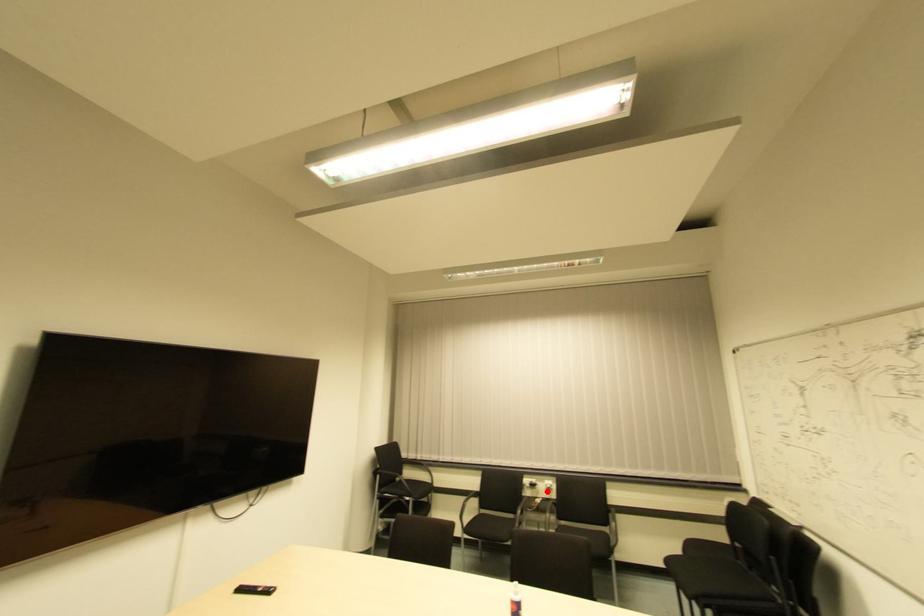
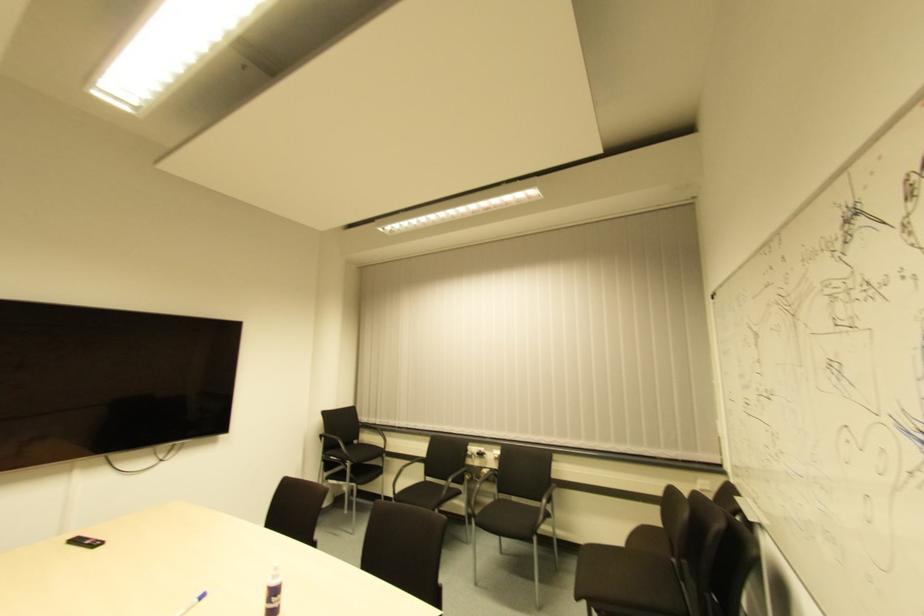
Question: I am providing you with two images of the same scene from different viewpoints. A red point is marked on the first image. Is the red point's position out of view in image 2?

Choices:
 (A) Yes
 (B) No

Answer: (B)